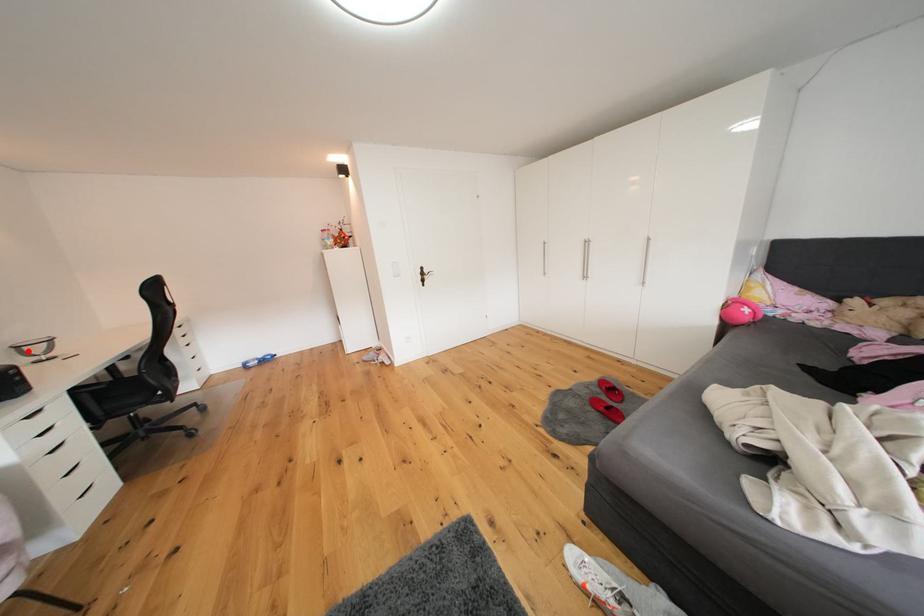
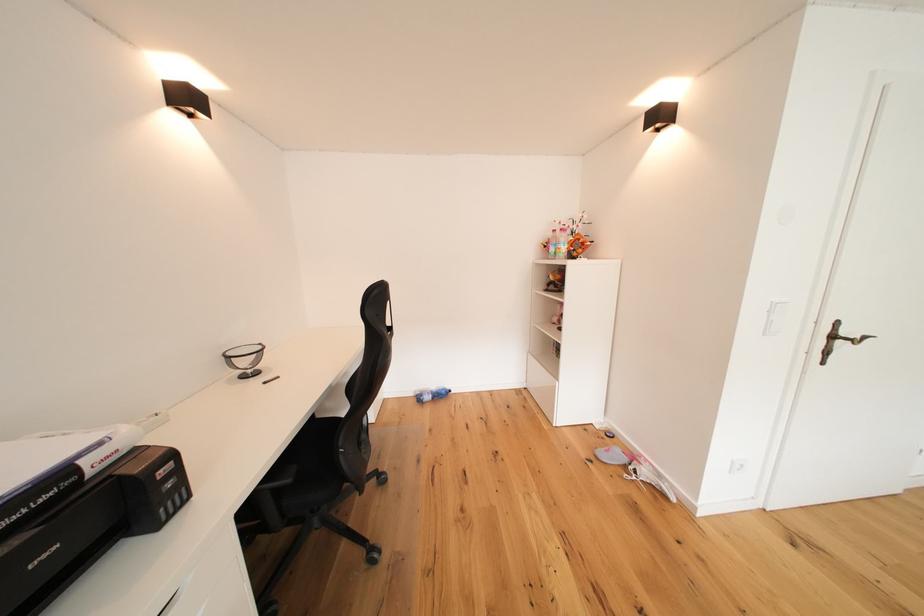
Find the pixel in the second image that matches the highlighted location in the first image.

(237, 362)